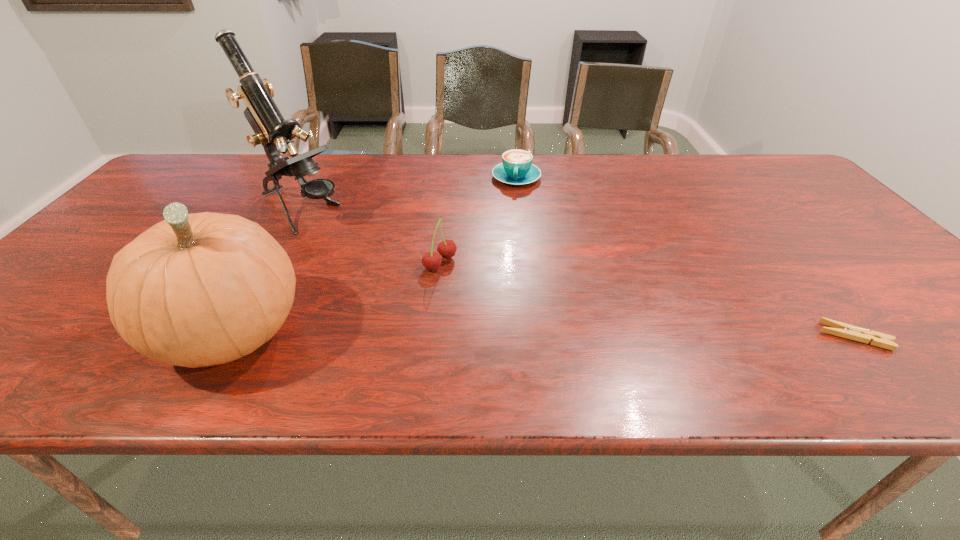
The image size is (960, 540). What are the coordinates of `free space on the desktop that is between the pumpkin and the shortest object and is positioned through the eyepiece of the microscope` in the screenshot? It's located at (508, 334).

This screenshot has width=960, height=540. I want to click on free space on the desktop that is between the pumpkin and the clothespin and is positioned with the handle on the right side of the fourth tallest object, so click(x=493, y=334).

Locate an element on the screen. free space on the desktop that is between the pumpkin and the clothespin and is positioned on the surface of the cherry is located at coordinates pos(574,335).